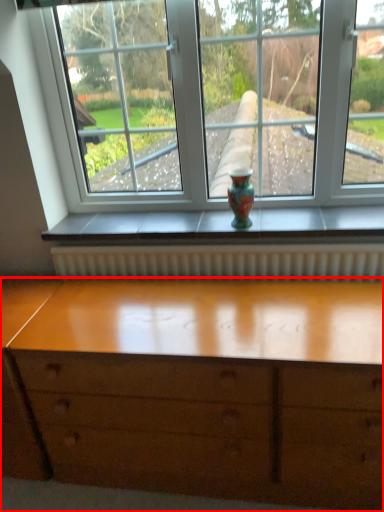
Question: From the image's perspective, where is chest of drawers (annotated by the red box) located relative to glass vase?

Choices:
 (A) below
 (B) above

Answer: (A)